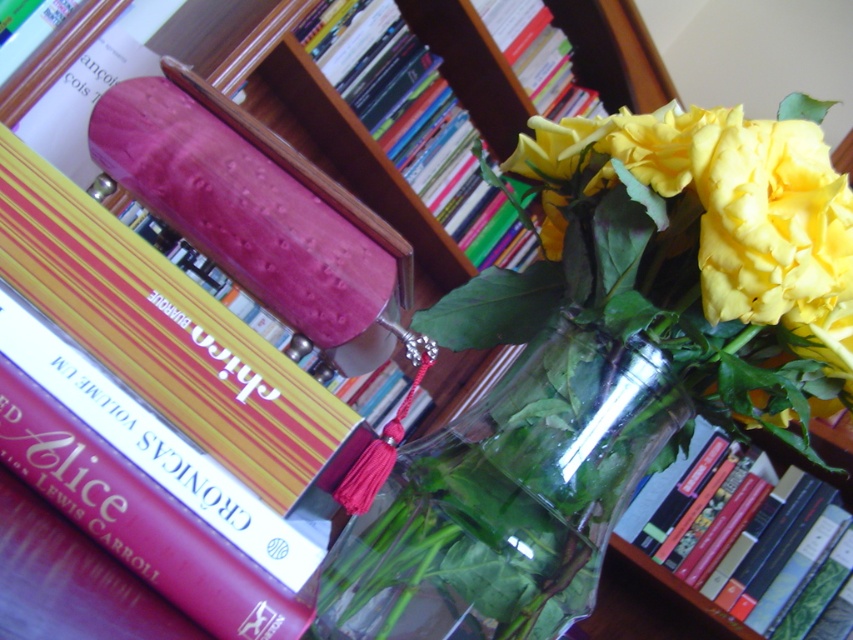
Looking at this image, is transparent glass vase at center taller than hardcover book at upper center?

In fact, transparent glass vase at center may be shorter than hardcover book at upper center.

Can you confirm if transparent glass vase at center is positioned to the left of hardcover book at upper center?

Yes, transparent glass vase at center is to the left of hardcover book at upper center.

Between point (381, 545) and point (839, 454), which one is positioned behind?

The point (839, 454) is behind.

The width and height of the screenshot is (853, 640). Find the location of `transparent glass vase at center`. transparent glass vase at center is located at coordinates (508, 499).

In the scene shown: Is matte purple book at upper center further to camera compared to hardcover book at upper center?

Yes, matte purple book at upper center is behind hardcover book at upper center.

Which of these two, matte purple book at upper center or hardcover book at upper center, stands shorter?

hardcover book at upper center is shorter.

You are a GUI agent. You are given a task and a screenshot of the screen. Output one action in this format:
    pyautogui.click(x=<x>, y=<y>)
    Task: Click on the matte purple book at upper center
    The image size is (853, 640).
    Given the screenshot: What is the action you would take?
    pyautogui.click(x=415, y=122)

Does transparent glass vase at center appear on the left side of matte purple book at upper center?

Incorrect, transparent glass vase at center is not on the left side of matte purple book at upper center.

Find the location of a particular element. This screenshot has height=640, width=853. transparent glass vase at center is located at coordinates (508, 499).